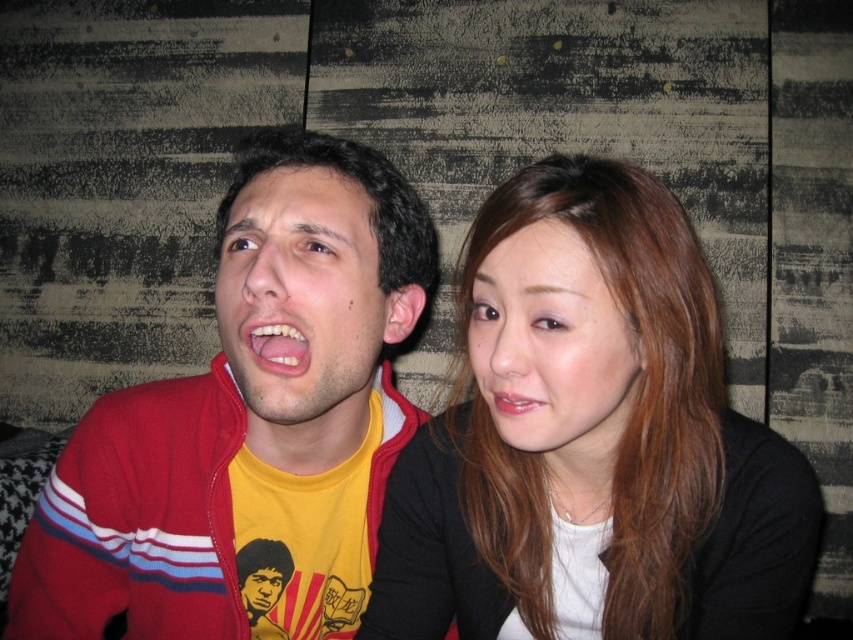
Question: Which object appears farthest from the camera in this image?

Choices:
 (A) matte pink lips at center
 (B) smooth skin face at center

Answer: (A)

Question: Which of these objects is positioned farthest from the smooth yellow t-shirt at center?

Choices:
 (A) matte yellow t-shirt at center
 (B) matte red jacket at left
 (C) smooth brown hair at center
 (D) white glossy teeth at center

Answer: (C)

Question: Which of the following is the farthest from the observer?

Choices:
 (A) matte yellow t-shirt at center
 (B) smooth brown hair at center
 (C) smooth yellow t-shirt at center
 (D) matte pink lips at center

Answer: (C)

Question: In this image, where is matte yellow t-shirt at center located relative to matte pink lips at center?

Choices:
 (A) above
 (B) below

Answer: (A)

Question: Does white glossy teeth at center have a lesser width compared to matte pink lips at center?

Choices:
 (A) no
 (B) yes

Answer: (A)

Question: Does white glossy teeth at center have a larger size compared to matte pink lips at center?

Choices:
 (A) no
 (B) yes

Answer: (A)